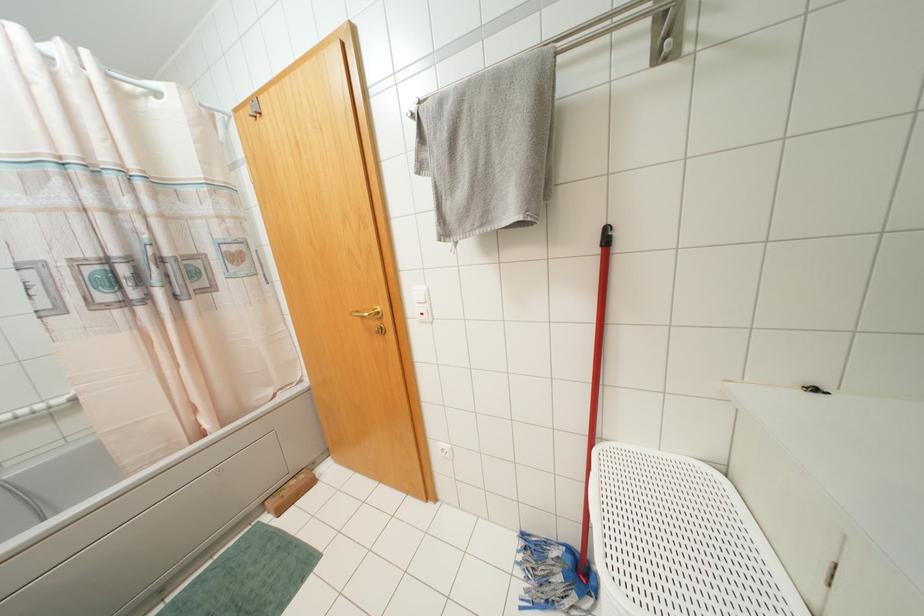
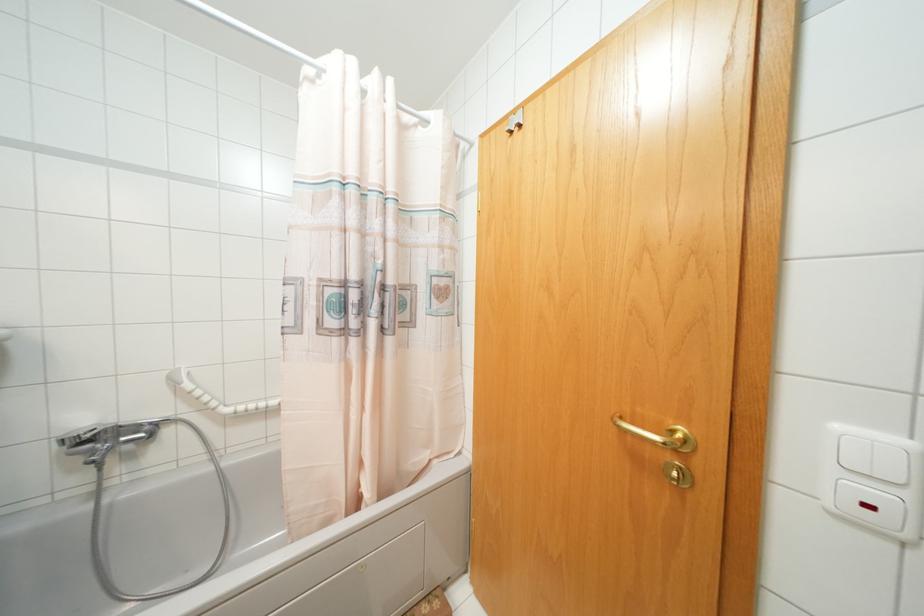
Question: The first image is from the beginning of the video and the second image is from the end. How did the camera likely rotate when shooting the video?

Choices:
 (A) Left
 (B) Right
 (C) Up
 (D) Down

Answer: (A)